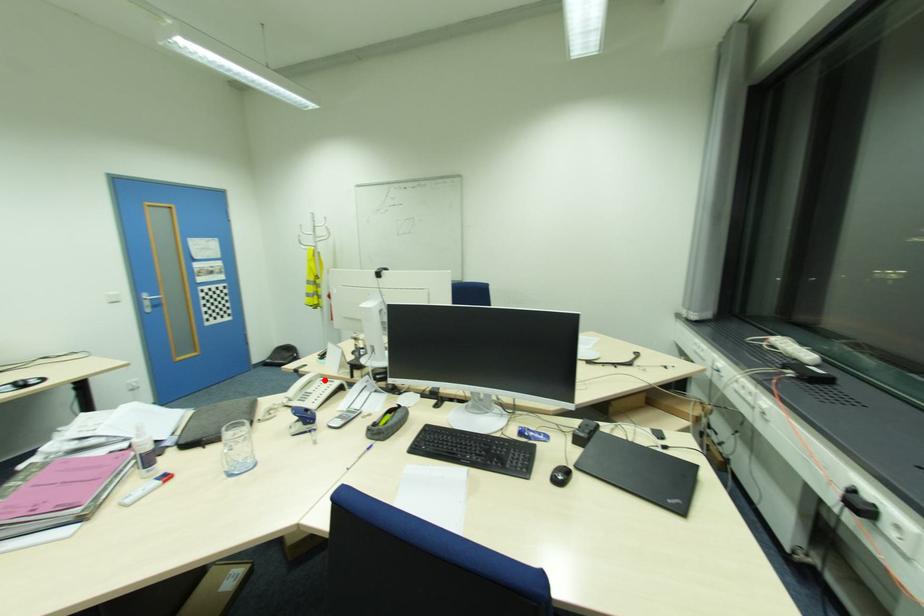
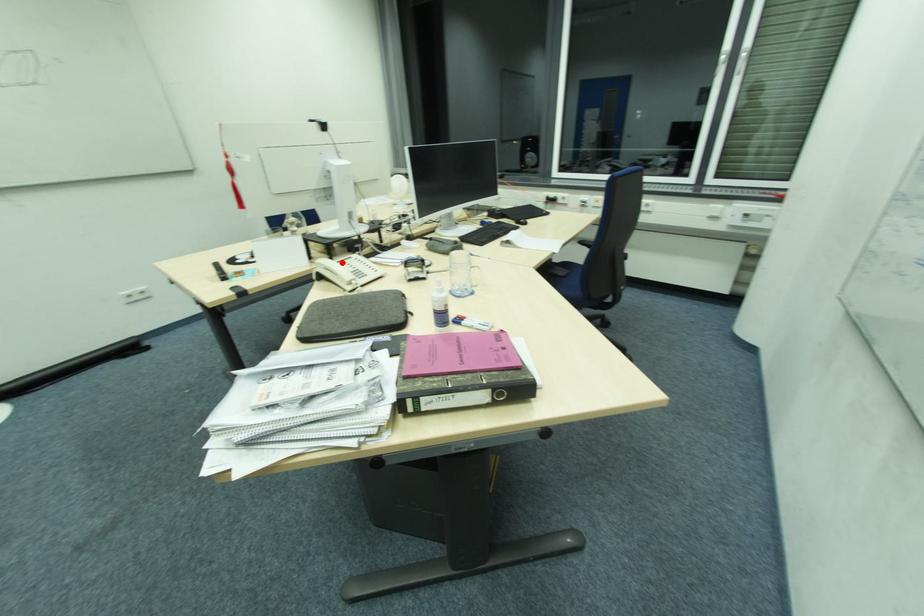
I am providing you with two images of the same scene from different viewpoints. A red point is marked on the first image and another point is marked on the second image. Is the red point in image1 aligned with the point shown in image2?

Yes